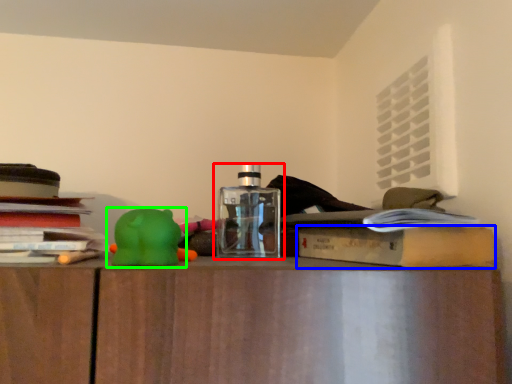
Question: Based on their relative distances, which object is farther from bottle (highlighted by a red box)? Choose from paperback book (highlighted by a blue box) and toy (highlighted by a green box).

Choices:
 (A) paperback book
 (B) toy

Answer: (A)